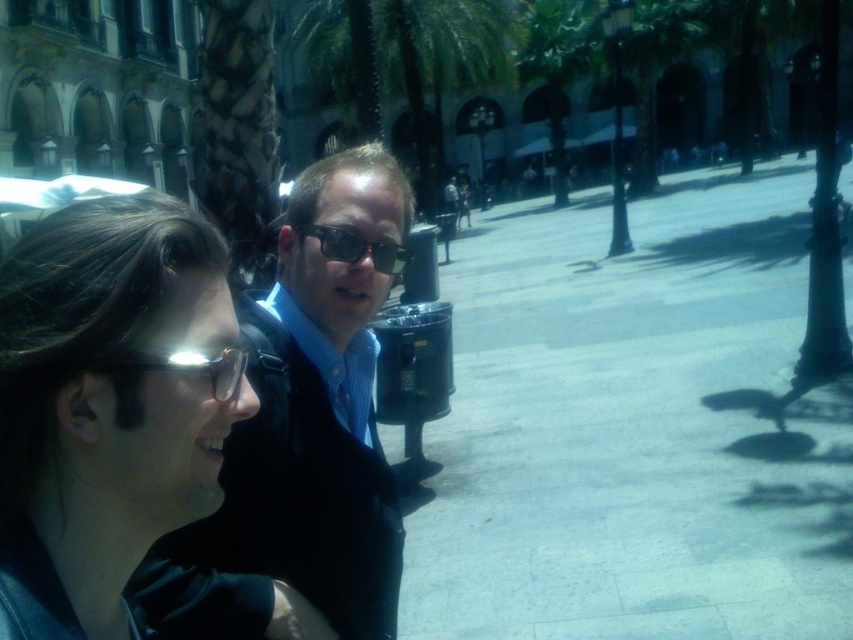
Is green leafy palm tree at center taller than transparent plastic goggles at lower left?

Yes.

Is green leafy palm tree at center to the right of transparent plastic goggles at lower left from the viewer's perspective?

Indeed, green leafy palm tree at center is positioned on the right side of transparent plastic goggles at lower left.

Who is more distant from viewer, [581,49] or [192,371]?

Point [581,49]

Find the location of a particular element. Image resolution: width=853 pixels, height=640 pixels. green leafy palm tree at center is located at coordinates (556, 67).

Does gray concrete pavement at center have a lesser width compared to green leafy palm tree at center?

In fact, gray concrete pavement at center might be wider than green leafy palm tree at center.

Which is more to the right, gray concrete pavement at center or green leafy palm tree at center?

green leafy palm tree at center is more to the right.

Does point (746, 518) come in front of point (548, 109)?

Yes.

The image size is (853, 640). In order to click on gray concrete pavement at center in this screenshot , I will do `click(636, 428)`.

Between gray concrete pavement at center and transparent plastic goggles at lower left, which one appears on the left side from the viewer's perspective?

transparent plastic goggles at lower left is more to the left.

Is point (705, 477) more distant than point (132, 358)?

Yes.

Where is `gray concrete pavement at center`? The image size is (853, 640). gray concrete pavement at center is located at coordinates (636, 428).

The width and height of the screenshot is (853, 640). I want to click on gray concrete pavement at center, so click(x=636, y=428).